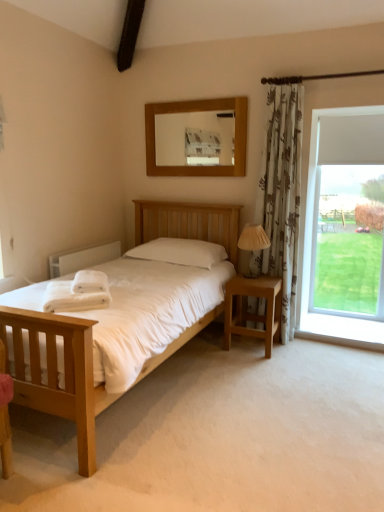
Question: Is white soft towel at lower left completely or partially inside wooden nightstand at right?

Choices:
 (A) yes
 (B) no

Answer: (B)

Question: Considering the relative sizes of wooden nightstand at right and white soft towel at lower left in the image provided, is wooden nightstand at right wider than white soft towel at lower left?

Choices:
 (A) no
 (B) yes

Answer: (A)

Question: Is wooden nightstand at right further to the viewer compared to white soft towel at lower left?

Choices:
 (A) yes
 (B) no

Answer: (A)

Question: Would you say wooden nightstand at right is a long distance from white soft towel at lower left?

Choices:
 (A) no
 (B) yes

Answer: (B)

Question: Does wooden nightstand at right touch white soft towel at lower left?

Choices:
 (A) no
 (B) yes

Answer: (A)

Question: Considering the positions of white painted radiator at left and white soft towels at left in the image, is white painted radiator at left wider or thinner than white soft towels at left?

Choices:
 (A) wide
 (B) thin

Answer: (B)

Question: From a real-world perspective, is white painted radiator at left above or below white soft towels at left?

Choices:
 (A) below
 (B) above

Answer: (A)

Question: Considering the positions of white painted radiator at left and white soft towels at left in the image, is white painted radiator at left bigger or smaller than white soft towels at left?

Choices:
 (A) big
 (B) small

Answer: (A)

Question: From their relative heights in the image, would you say white painted radiator at left is taller or shorter than white soft towels at left?

Choices:
 (A) tall
 (B) short

Answer: (A)

Question: Which is correct: brown fabric curtain at upper right is inside beige fabric lampshade at right, or outside of it?

Choices:
 (A) inside
 (B) outside

Answer: (B)

Question: In the image, is brown fabric curtain at upper right positioned in front of or behind beige fabric lampshade at right?

Choices:
 (A) behind
 (B) front

Answer: (B)

Question: Is brown fabric curtain at upper right to the left or to the right of beige fabric lampshade at right in the image?

Choices:
 (A) left
 (B) right

Answer: (B)

Question: In terms of width, does brown fabric curtain at upper right look wider or thinner when compared to beige fabric lampshade at right?

Choices:
 (A) thin
 (B) wide

Answer: (A)

Question: Considering the positions of light wood bed at center and white painted radiator at left in the image, is light wood bed at center taller or shorter than white painted radiator at left?

Choices:
 (A) tall
 (B) short

Answer: (A)

Question: Is point (72, 327) positioned closer to the camera than point (97, 254)?

Choices:
 (A) farther
 (B) closer

Answer: (B)